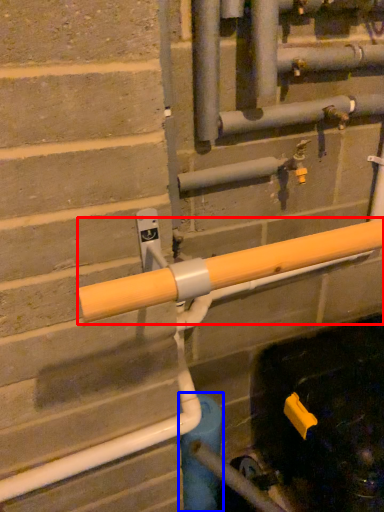
Question: Which point is closer to the camera, beam (highlighted by a red box) or water pipe (highlighted by a blue box)?

Choices:
 (A) beam
 (B) water pipe

Answer: (A)